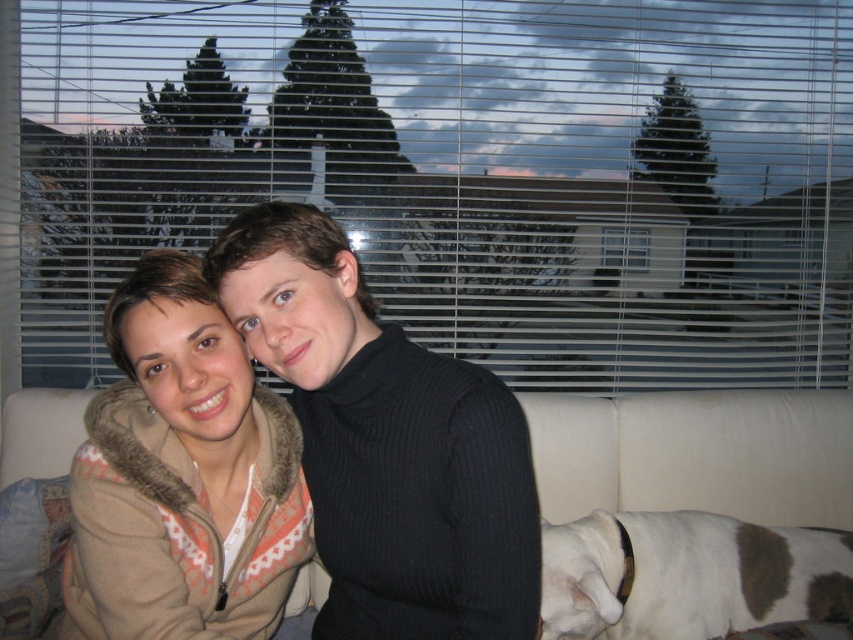
Question: Can you confirm if beige fleece jacket at center is positioned to the right of beige fabric couch at center?

Choices:
 (A) no
 (B) yes

Answer: (A)

Question: Among these objects, which one is farthest from the camera?

Choices:
 (A) camouflage fleece jacket at center
 (B) white fur at lower right
 (C) beige fabric couch at center
 (D) transparent plastic blinds at upper center

Answer: (D)

Question: Based on their relative distances, which object is nearer to the beige fleece jacket at center?

Choices:
 (A) white fur at lower right
 (B) camouflage fleece jacket at center

Answer: (B)

Question: Can you confirm if beige fleece jacket at center is positioned to the left of beige fabric couch at center?

Choices:
 (A) yes
 (B) no

Answer: (A)

Question: Which of these objects is positioned closest to the beige fleece jacket at center?

Choices:
 (A) white fur at lower right
 (B) beige fabric couch at center
 (C) transparent plastic blinds at upper center
 (D) camouflage fleece jacket at center

Answer: (D)

Question: Is camouflage fleece jacket at center bigger than beige fabric couch at center?

Choices:
 (A) no
 (B) yes

Answer: (B)